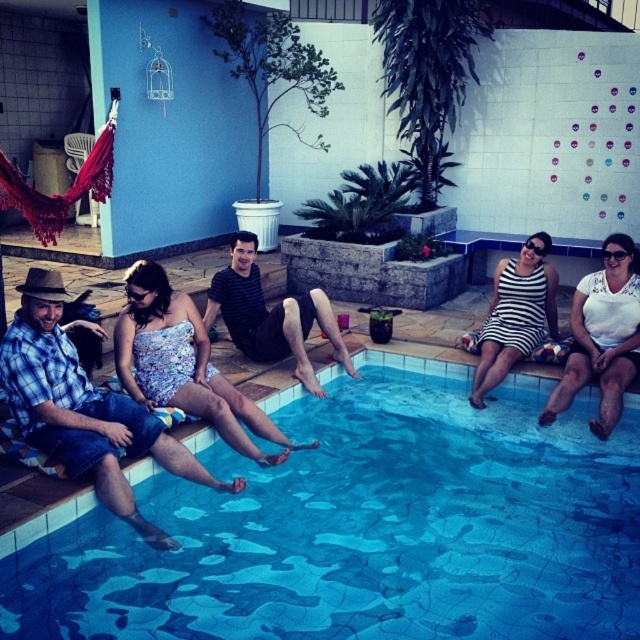
You are designing a new fashion collection and want to incorporate both the floral fabric dress at center and the striped fabric shirt at center. Since you need to know their relative sizes for pattern making, which one is taller?

The floral fabric dress at center is taller than the striped fabric shirt at center.

You are standing at the edge of the pool and want to place a small umbrella between the two points, point (172, 378) and point (252, 332). Which point is closer to you so you can place the umbrella there?

Point (172, 378) is closer to the viewer than point (252, 332), so you should place the umbrella there.

You are a lifeguard who needs to reach the blue plaid shirt at left from the blue mosaic tiles at center. Can you reach it within 1 meter without moving?

The distance between blue mosaic tiles at center and blue plaid shirt at left is 37.61 inches, which is approximately 0.956 meters. Since this is under 1 meter, yes, you can reach the blue plaid shirt at left within 1 meter without moving.